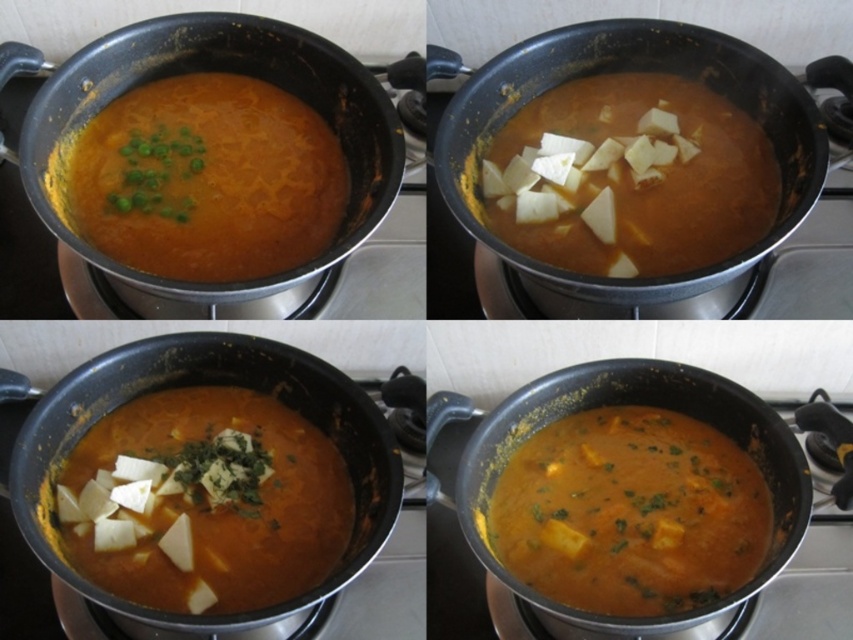
Which is in front, point (184, 602) or point (252, 166)?

Point (184, 602) is more forward.

Can you confirm if white crumbly tofu at center is shorter than matte orange soup at upper left?

Yes, white crumbly tofu at center is shorter than matte orange soup at upper left.

Identify the location of white crumbly tofu at center. (206, 500).

From the picture: Does matte orange soup at upper left have a larger size compared to white creamy cubes at center?

Yes.

What do you see at coordinates (207, 179) in the screenshot? The width and height of the screenshot is (853, 640). I see `matte orange soup at upper left` at bounding box center [207, 179].

This screenshot has height=640, width=853. In order to click on matte orange soup at upper left in this screenshot , I will do `click(207, 179)`.

Who is positioned more to the left, orange matte curry at center or matte orange soup at upper left?

matte orange soup at upper left is more to the left.

Who is more forward, (589, 515) or (137, 180)?

Point (589, 515) is more forward.

Locate an element on the screen. The width and height of the screenshot is (853, 640). orange matte curry at center is located at coordinates (630, 513).